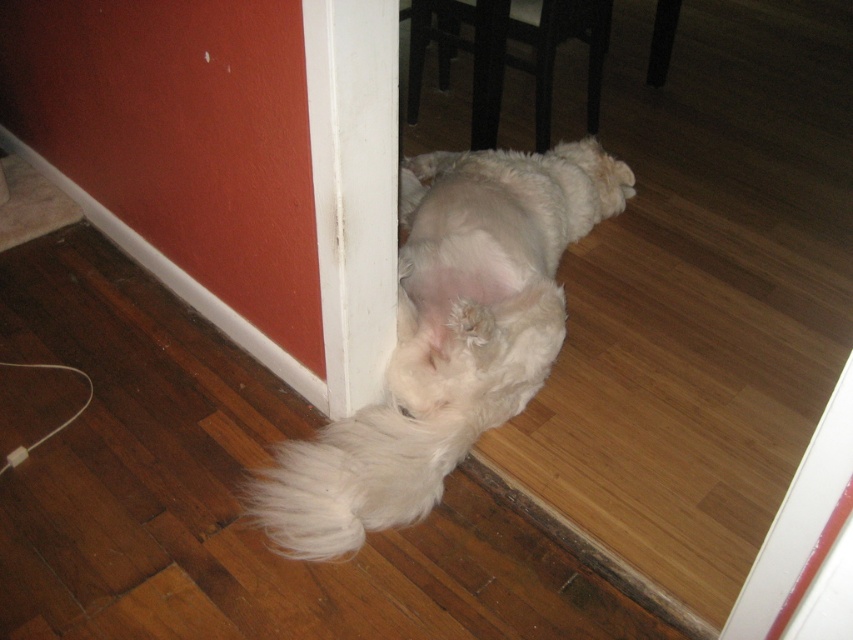
Question: Is white fluffy cat at lower center bigger than white fluffy tail at lower center?

Choices:
 (A) no
 (B) yes

Answer: (B)

Question: Which of the following is the farthest from the observer?

Choices:
 (A) (389, 436)
 (B) (405, 512)

Answer: (A)

Question: Is white fluffy cat at lower center thinner than white fluffy tail at lower center?

Choices:
 (A) no
 (B) yes

Answer: (A)

Question: Does white fluffy cat at lower center have a greater width compared to white fluffy tail at lower center?

Choices:
 (A) yes
 (B) no

Answer: (A)